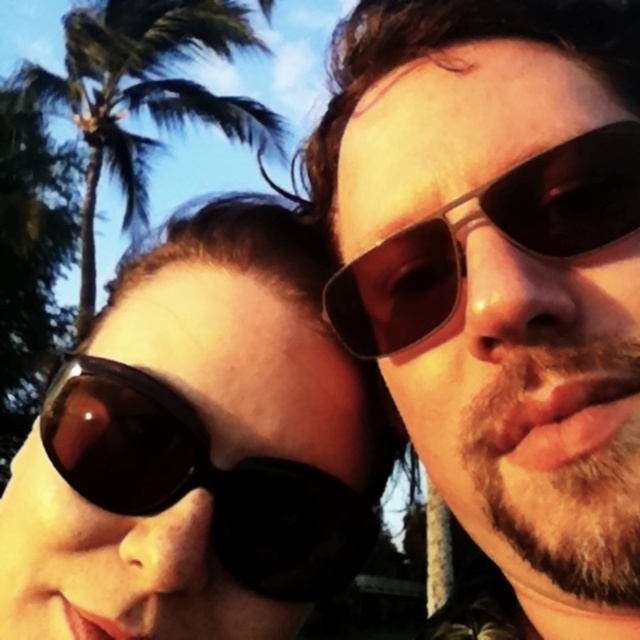
Who is more forward, (198,419) or (410,291)?

Point (410,291) is in front.

Looking at this image, is matte black goggles at left shorter than matte black sunglasses at right?

No.

Is point (128, 458) less distant than point (529, 211)?

No.

Image resolution: width=640 pixels, height=640 pixels. I want to click on matte black goggles at left, so click(x=202, y=481).

Based on the photo, does matte black goggles at left have a greater width compared to green leafy palm tree at upper left?

No.

Is matte black goggles at left thinner than green leafy palm tree at upper left?

Indeed, matte black goggles at left has a lesser width compared to green leafy palm tree at upper left.

The image size is (640, 640). Describe the element at coordinates (202, 481) in the screenshot. I see `matte black goggles at left` at that location.

Image resolution: width=640 pixels, height=640 pixels. I want to click on matte black goggles at left, so click(x=202, y=481).

Is matte black sunglasses at left taller than matte black goggles at left?

Yes.

Is point (273, 321) closer to viewer compared to point (280, 483)?

No, it is not.

Is point (316, 566) more distant than point (51, 456)?

Yes, point (316, 566) is farther from viewer.

Locate an element on the screen. This screenshot has height=640, width=640. matte black sunglasses at left is located at coordinates (198, 448).